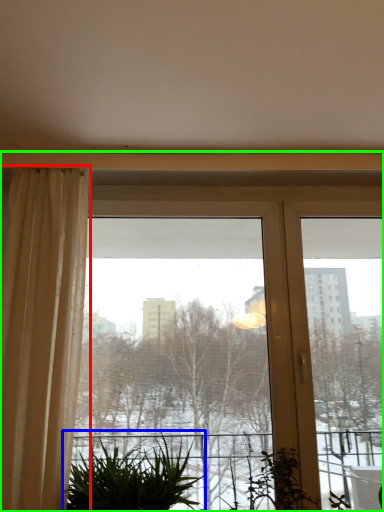
Question: Which object is the farthest from curtain (highlighted by a red box)? Choose among these: houseplant (highlighted by a blue box) or window (highlighted by a green box).

Choices:
 (A) houseplant
 (B) window

Answer: (B)